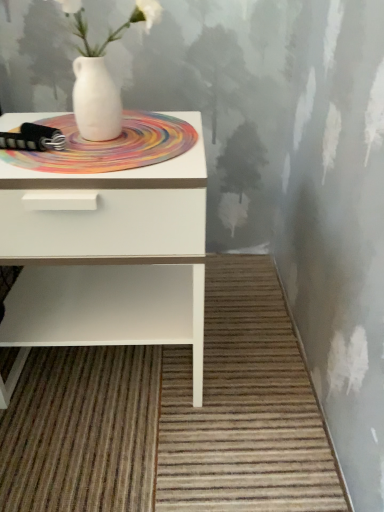
Question: Is white glossy nightstand at left a part of white matte vase at upper center?

Choices:
 (A) yes
 (B) no

Answer: (B)

Question: Are white matte vase at upper center and white glossy nightstand at left located far from each other?

Choices:
 (A) no
 (B) yes

Answer: (A)

Question: Is white matte vase at upper center smaller than white glossy nightstand at left?

Choices:
 (A) no
 (B) yes

Answer: (B)

Question: Does white matte vase at upper center come behind white glossy nightstand at left?

Choices:
 (A) no
 (B) yes

Answer: (A)

Question: From a real-world perspective, is white matte vase at upper center under white glossy nightstand at left?

Choices:
 (A) yes
 (B) no

Answer: (B)

Question: Considering the relative sizes of white matte vase at upper center and white glossy nightstand at left in the image provided, is white matte vase at upper center wider than white glossy nightstand at left?

Choices:
 (A) no
 (B) yes

Answer: (A)

Question: Is multicolored woven mat at center further to camera compared to white glossy nightstand at left?

Choices:
 (A) no
 (B) yes

Answer: (B)

Question: Does multicolored woven mat at center have a greater width compared to white glossy nightstand at left?

Choices:
 (A) no
 (B) yes

Answer: (A)

Question: Is multicolored woven mat at center smaller than white glossy nightstand at left?

Choices:
 (A) no
 (B) yes

Answer: (B)

Question: Is multicolored woven mat at center not close to white glossy nightstand at left?

Choices:
 (A) no
 (B) yes

Answer: (A)

Question: Is multicolored woven mat at center at the right side of white glossy nightstand at left?

Choices:
 (A) yes
 (B) no

Answer: (A)

Question: Does multicolored woven mat at center have a larger size compared to white glossy nightstand at left?

Choices:
 (A) yes
 (B) no

Answer: (B)

Question: Is the depth of white matte vase at upper center less than that of multicolored woven mat at center?

Choices:
 (A) yes
 (B) no

Answer: (A)